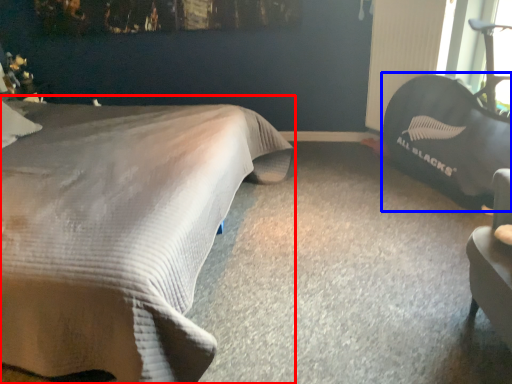
Question: Which object is closer to the camera taking this photo, bed (highlighted by a red box) or bean bag chair (highlighted by a blue box)?

Choices:
 (A) bed
 (B) bean bag chair

Answer: (A)